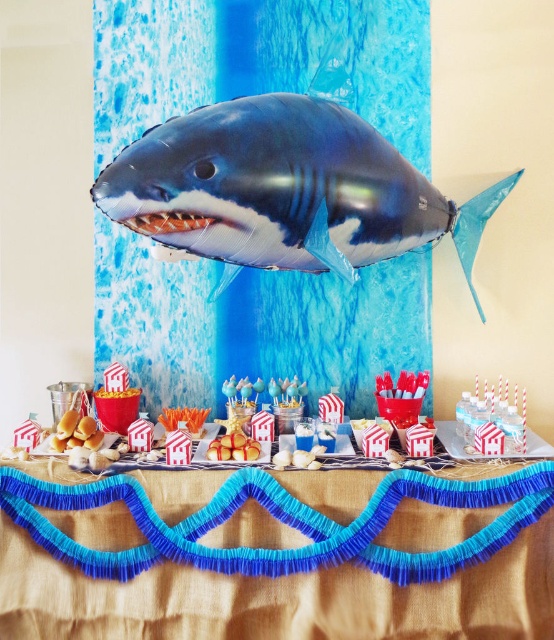
In the scene shown: Can you confirm if blue paper garland at center is positioned to the right of white paper houses at center?

Incorrect, blue paper garland at center is not on the right side of white paper houses at center.

What do you see at coordinates (277, 556) in the screenshot? I see `blue paper garland at center` at bounding box center [277, 556].

You are a GUI agent. You are given a task and a screenshot of the screen. Output one action in this format:
    pyautogui.click(x=<x>, y=<y>)
    Task: Click on the blue paper garland at center
    Image resolution: width=554 pixels, height=640 pixels.
    Given the screenshot: What is the action you would take?
    pyautogui.click(x=277, y=556)

Locate an element on the screen. blue paper garland at center is located at coordinates (277, 556).

Between blue paper garland at center and shiny metallic shark at upper center, which one has more height?

shiny metallic shark at upper center

Who is more distant from viewer, (317,493) or (324,141)?

The point (317,493) is behind.

Does point (234, 602) come closer to viewer compared to point (274, 180)?

No, (234, 602) is behind (274, 180).

The width and height of the screenshot is (554, 640). In order to click on blue paper garland at center in this screenshot , I will do `click(277, 556)`.

Who is positioned more to the left, shiny metallic shark at upper center or white paper houses at center?

white paper houses at center is more to the left.

Is point (233, 154) closer to camera compared to point (530, 440)?

Yes, it is.

Find the location of `shiny metallic shark at upper center`. shiny metallic shark at upper center is located at coordinates (285, 188).